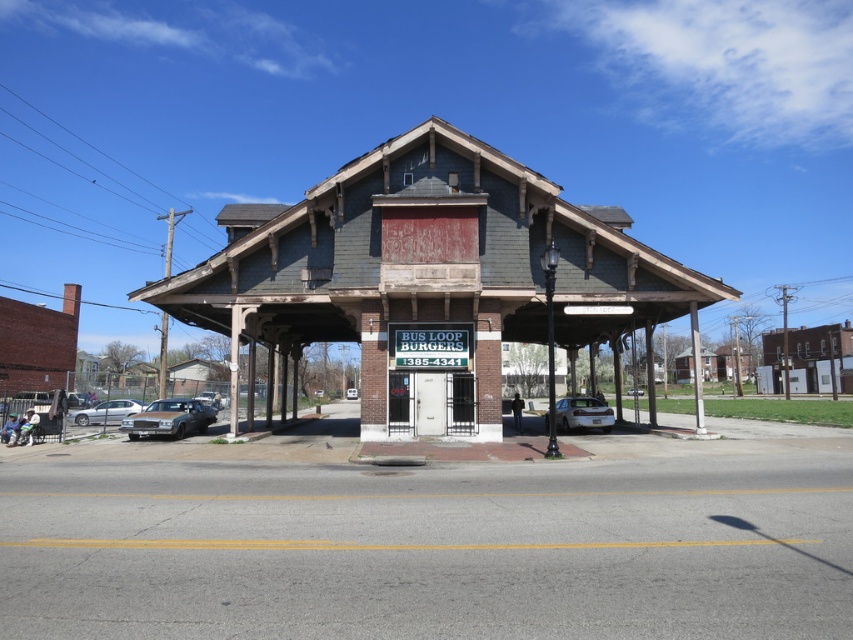
You are a delivery person trying to park your truck, which is 2 meters wide, in front of the brick building at center. There is a satin silver sedan at center parked there. Can you park your truck next to the sedan without overlapping them?

The brick building at center is larger than the satin silver sedan at center, but the description does not provide information about the available space between them. Therefore, it is uncertain if there is enough room to park the truck next to the sedan without overlapping.

You are standing at the entrance of the historic building and want to park your car in the closest available spot. The parking spots are marked at coordinates ranging from 0.0 to 1.0 in both x and y directions. Your current position is at coordinate point 0.5, 0.5. Is the shiny silver sedan at lower left parked closer to you than the parking spot at coordinate point 0.6, 0.2?

The shiny silver sedan at lower left is parked at point (169, 419). The distance from your position at (426, 320) to the sedan is sqrt of squared differences in x and y coordinates. Calculating sqrt of squared difference between 0.655 and 0.5 in x, which is 0.155 squared equals 0.024, plus squared difference between 0.199 and 0.5 in y, which is 0.301 squared equals 0.0906. Total distance squared is 0.1146, so distance is approx 0.338. The parking spot at (170, 384) is at distance sqrt of squared difference in